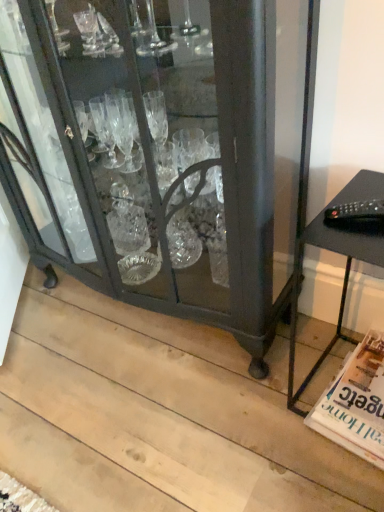
Where is `free space behind white glossy magazine at lower right`? free space behind white glossy magazine at lower right is located at coordinates (317, 341).